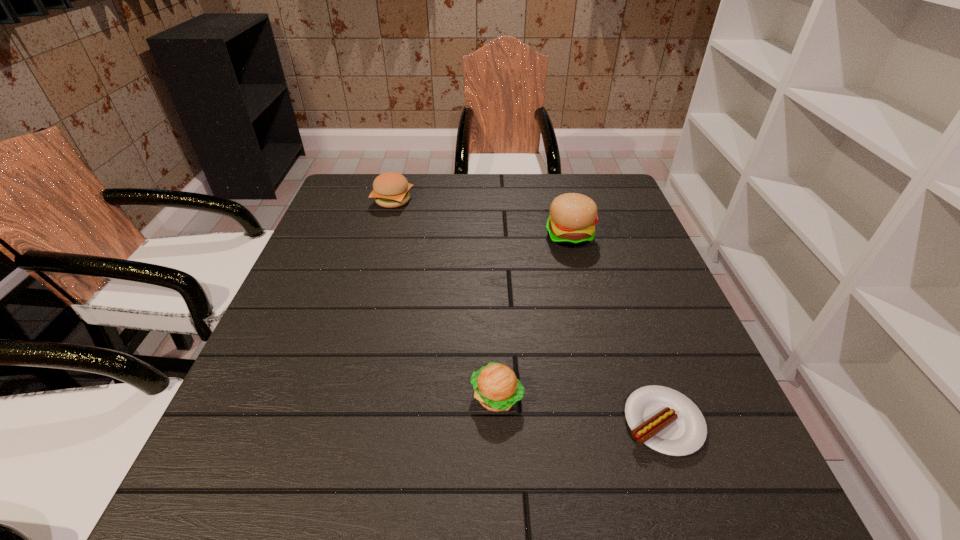
In the image, there is a desktop. In order to click on vacant space at the far left corner in this screenshot , I will do `click(371, 179)`.

The width and height of the screenshot is (960, 540). I want to click on vacant space that is in between the nearest hamburger and the rightmost hamburger, so click(533, 317).

At what (x,y) coordinates should I click in order to perform the action: click on vacant area between the shortest object and the third tallest object. Please return your answer as a coordinate pair (x, y). Looking at the image, I should click on (580, 410).

I want to click on free area in between the sausage and the tallest hamburger, so click(616, 329).

Find the location of a particular element. free spot between the third object from right to left and the shortest object is located at coordinates (580, 410).

Locate an element on the screen. The height and width of the screenshot is (540, 960). blank region between the third tallest object and the sausage is located at coordinates (580, 410).

Identify the location of vacant space in between the sausage and the tallest hamburger. (616, 329).

Where is `vacant space that is in between the second object from left to right and the rightmost hamburger`? vacant space that is in between the second object from left to right and the rightmost hamburger is located at coordinates (533, 317).

The image size is (960, 540). I want to click on free space that is in between the third object from right to left and the sausage, so click(x=580, y=410).

Locate an element on the screen. free space between the shortest hamburger and the tallest hamburger is located at coordinates (533, 317).